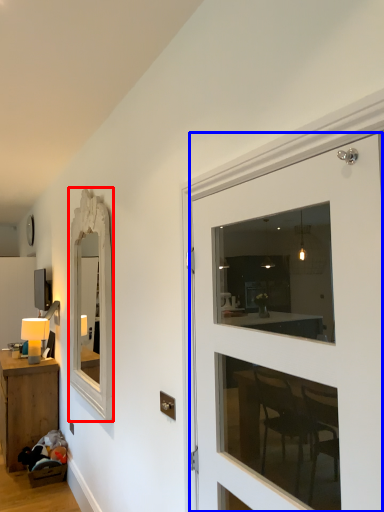
Question: Which of the following is the closest to the observer, mirror (highlighted by a red box) or door (highlighted by a blue box)?

Choices:
 (A) mirror
 (B) door

Answer: (B)